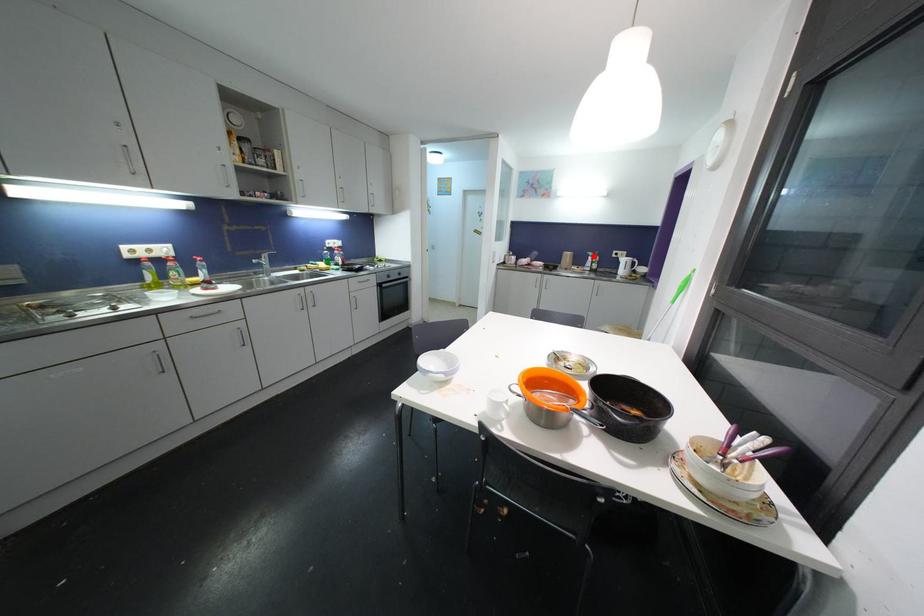
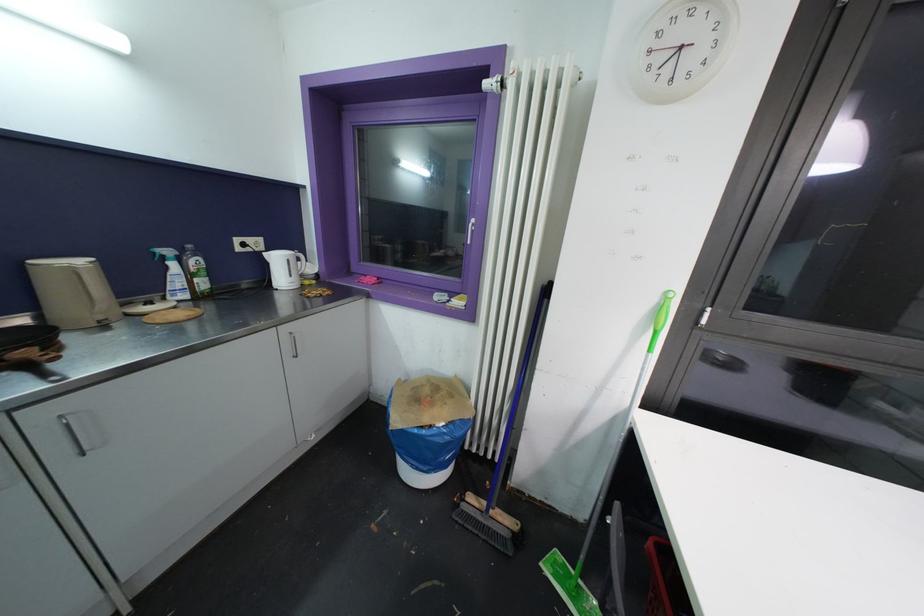
Find the pixel in the second image that matches the highlighted location in the first image.

(171, 254)